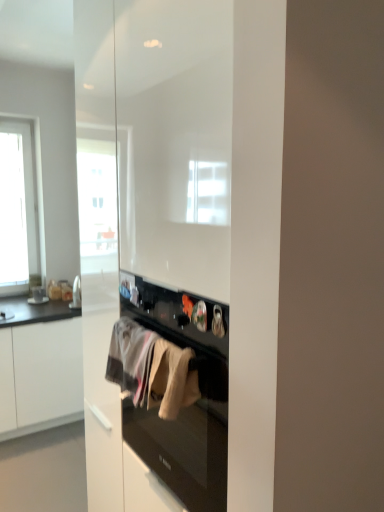
Question: From a real-world perspective, relative to white cotton towel at center, marked as the second clothing in a right-to-left arrangement, is white cotton towel at center, placed as the 2th clothing when sorted from left to right, vertically above or below?

Choices:
 (A) below
 (B) above

Answer: (B)

Question: Is white cotton towel at center, the 1th clothing when ordered from right to left, bigger or smaller than white cotton towel at center, placed as the 2th clothing when sorted from front to back?

Choices:
 (A) big
 (B) small

Answer: (B)

Question: Which object is positioned closest to the white cotton towel at center, the 2th clothing in the back-to-front sequence?

Choices:
 (A) white matte cabinet at left
 (B) white cotton towel at center, marked as the second clothing in a right-to-left arrangement

Answer: (B)

Question: Estimate the real-world distances between objects in this image. Which object is closer to the white cotton towel at center, the 2th clothing in the back-to-front sequence?

Choices:
 (A) white cotton towel at center, the first clothing in the left-to-right sequence
 (B) white matte cabinet at left

Answer: (A)